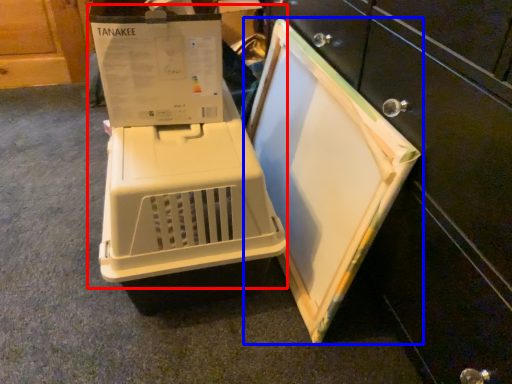
Question: Which object is further to the camera taking this photo, appliance (highlighted by a red box) or home appliance (highlighted by a blue box)?

Choices:
 (A) appliance
 (B) home appliance

Answer: (A)